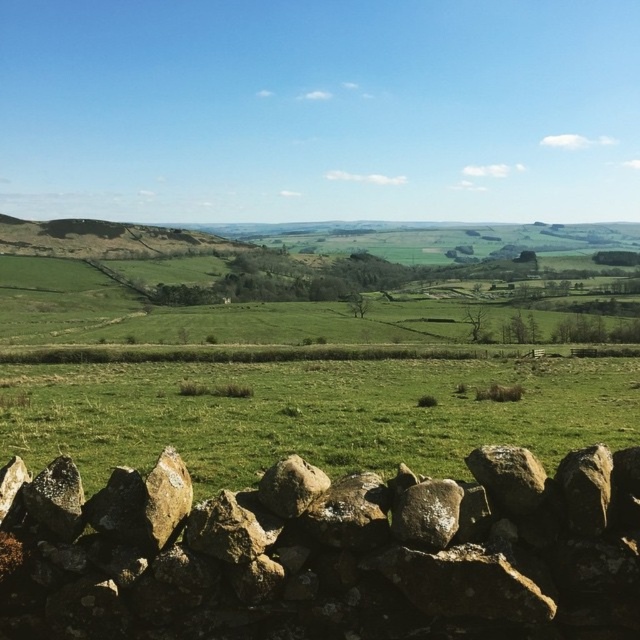
Question: Which object appears farthest from the camera in this image?

Choices:
 (A) brown rough stone at lower center
 (B) rusty metallic rock at center
 (C) green grassy field at center

Answer: (C)

Question: Is brown rough stone at lower center below green grassy field at center?

Choices:
 (A) yes
 (B) no

Answer: (B)

Question: Which point is closer to the camera taking this photo?

Choices:
 (A) (452, 465)
 (B) (316, 476)
 (C) (324, 550)

Answer: (C)

Question: Among these points, which one is farthest from the camera?

Choices:
 (A) (118, 532)
 (B) (388, 468)

Answer: (B)

Question: Is brown rough stone at lower center closer to the viewer compared to green grassy field at center?

Choices:
 (A) no
 (B) yes

Answer: (B)

Question: Is green grassy field at center above rusty metallic rock at center?

Choices:
 (A) yes
 (B) no

Answer: (B)